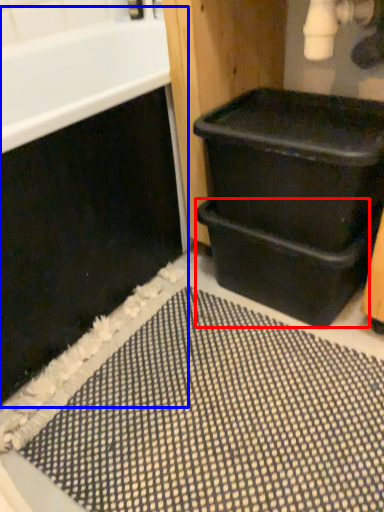
Question: Among these objects, which one is farthest to the camera, drawer (highlighted by a red box) or bath (highlighted by a blue box)?

Choices:
 (A) drawer
 (B) bath

Answer: (A)